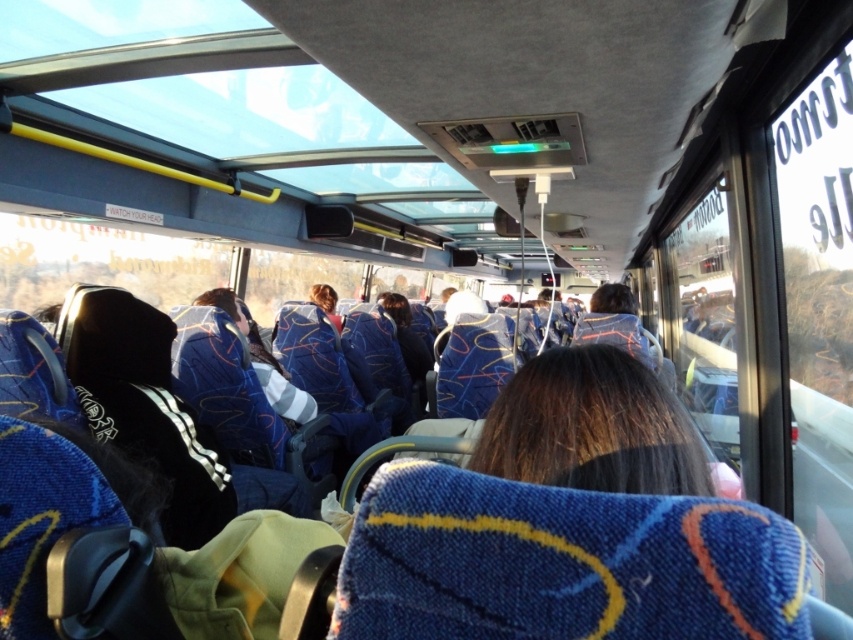
You are a passenger on the bus and want to take a photo of the brown hair at center and the blue fabric jacket at center through the window. Which object will appear larger in your photo?

The brown hair at center will appear larger in the photo because it is closer to the viewer than the blue fabric jacket at center.